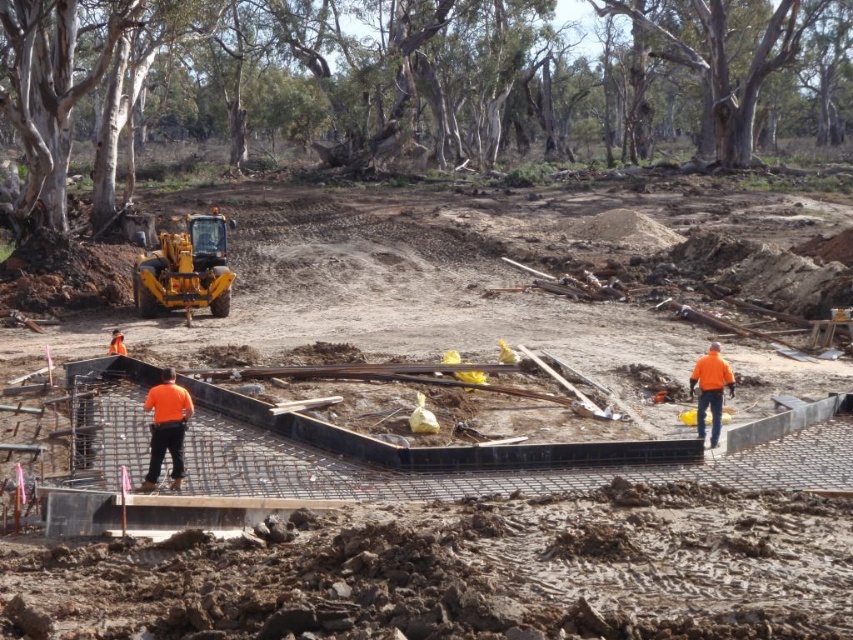
Question: Among these points, which one is nearest to the camera?

Choices:
 (A) (712, 374)
 (B) (210, 234)
 (C) (167, 397)
 (D) (27, 342)

Answer: (C)

Question: Is black concrete foundation at center positioned before orange fabric construction worker at right?

Choices:
 (A) no
 (B) yes

Answer: (B)

Question: Does orange fabric construction worker at center appear over orange fabric construction worker at right?

Choices:
 (A) yes
 (B) no

Answer: (B)

Question: Is black concrete foundation at center positioned in front of orange fabric construction worker at center?

Choices:
 (A) no
 (B) yes

Answer: (B)

Question: Which point is closer to the camera?

Choices:
 (A) black concrete foundation at center
 (B) orange fabric construction worker at center
 (C) orange fabric construction worker at right
 (D) yellow metallic excavator at center

Answer: (A)

Question: Which of the following is the farthest from the observer?

Choices:
 (A) (688, 385)
 (B) (303, 380)
 (C) (155, 401)

Answer: (A)